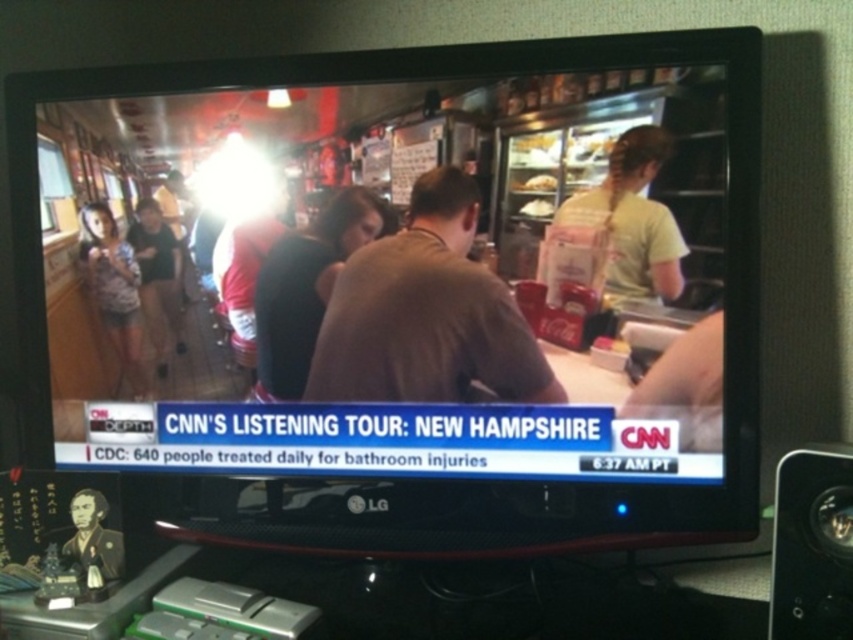
Can you confirm if brown cotton shirt at center is positioned to the left of matte red shirt at center?

No, brown cotton shirt at center is not to the left of matte red shirt at center.

Measure the distance between brown cotton shirt at center and matte red shirt at center.

brown cotton shirt at center and matte red shirt at center are 6.38 inches apart from each other.

Measure the distance between brown cotton shirt at center and camera.

86.17 centimeters

In order to click on brown cotton shirt at center in this screenshot , I will do `click(426, 314)`.

Looking at this image, which is more to the left, dark brown shirt at center or matte pink shirt at left?

From the viewer's perspective, matte pink shirt at left appears more on the left side.

Is point (318, 280) positioned after point (120, 292)?

No.

The height and width of the screenshot is (640, 853). What are the coordinates of `dark brown shirt at center` in the screenshot? It's located at (306, 285).

Does dark brown shirt at center have a lesser width compared to matte red shirt at center?

In fact, dark brown shirt at center might be wider than matte red shirt at center.

Which of these two, dark brown shirt at center or matte red shirt at center, stands taller?

dark brown shirt at center is taller.

Between point (341, 250) and point (221, 269), which one is positioned behind?

Positioned behind is point (221, 269).

Where is `dark brown shirt at center`? The width and height of the screenshot is (853, 640). dark brown shirt at center is located at coordinates (306, 285).